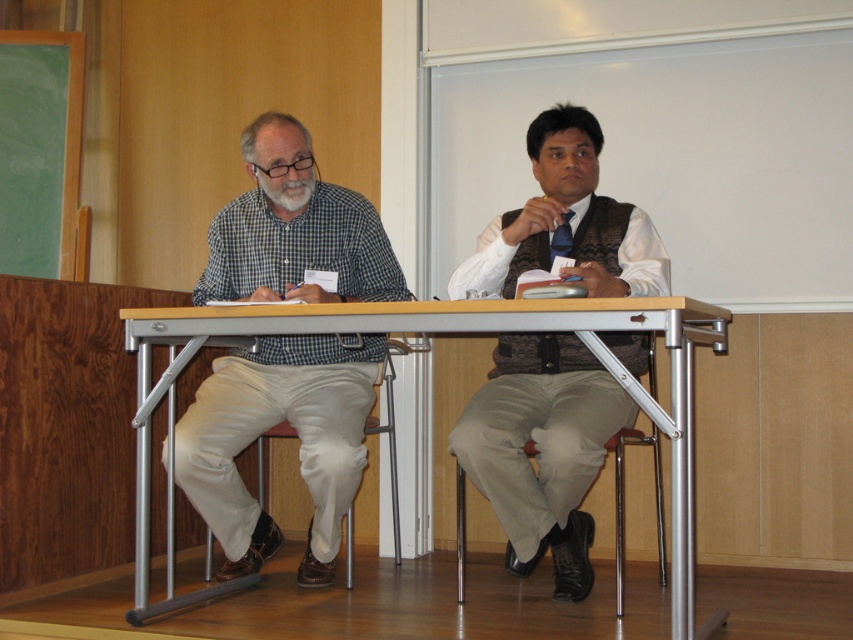
You are standing in front of the table in the classroom scene. There are two points marked on the table surface. The first point is at coordinates point [648,333] and the second is at point [583,301]. Which point is closer to you?

Point [583,301] is closer to you because it is nearer to the camera compared to point [648,333], which is further away.

You are standing in front of the table in the classroom scene. If you want to reach the checkered fabric shirt at left, which direction should you move relative to your current position?

The checkered fabric shirt at left is located at coordinates 0.667 on the x axis and 0.319 on the y axis. Since you are standing in front of the table, you should move towards the left side of the table to reach it.